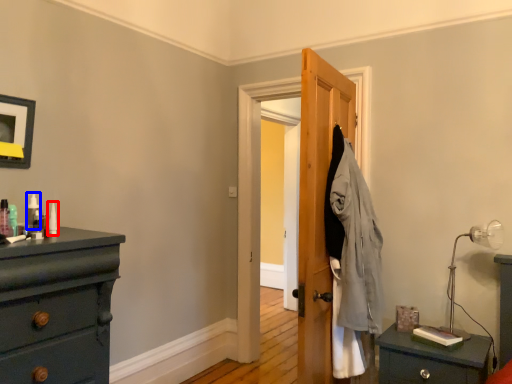
Question: Which of the following is the farthest to the observer, toiletry (highlighted by a red box) or toiletry (highlighted by a blue box)?

Choices:
 (A) toiletry
 (B) toiletry

Answer: (A)